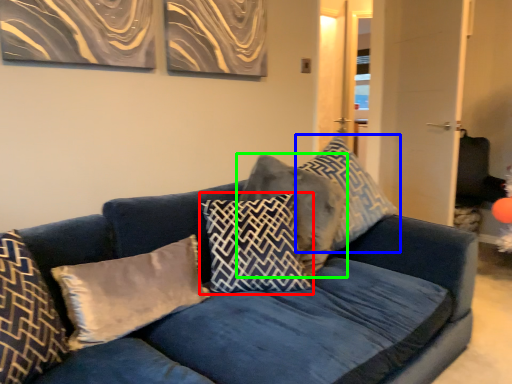
Question: Which object is the farthest from pillow (highlighted by a red box)? Choose among these: pillow (highlighted by a blue box) or pillow (highlighted by a green box).

Choices:
 (A) pillow
 (B) pillow

Answer: (A)